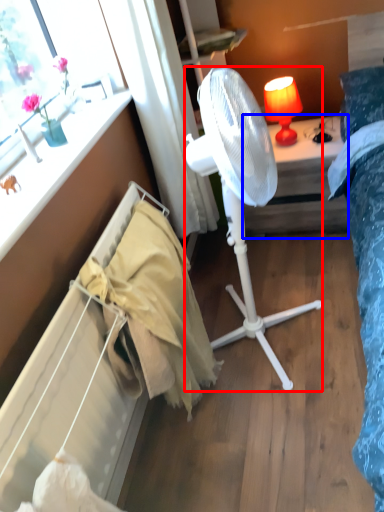
Question: Which of the following is the farthest to the observer, mechanical fan (highlighted by a red box) or desk (highlighted by a blue box)?

Choices:
 (A) mechanical fan
 (B) desk

Answer: (B)